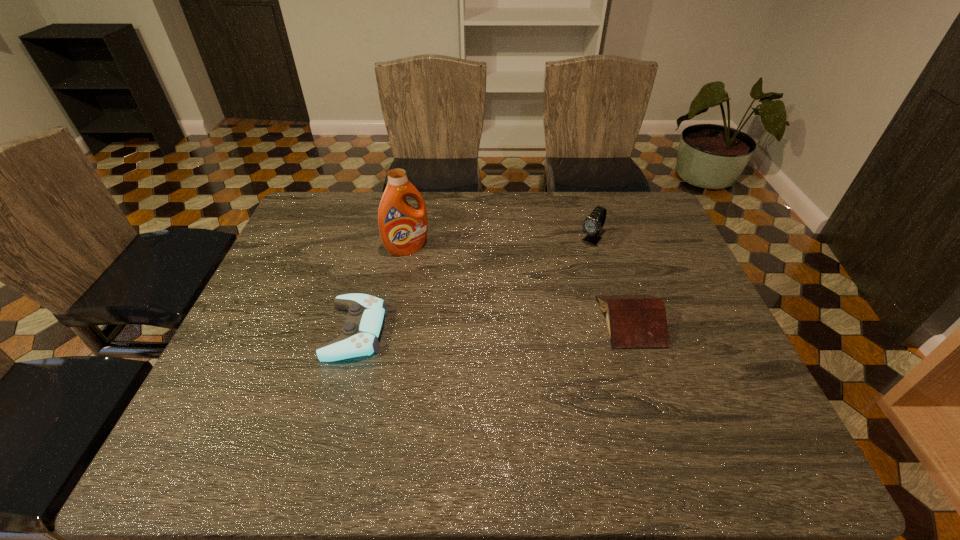
Find the location of `vacant region located 0.280m on the front-facing side of the tallest object`. vacant region located 0.280m on the front-facing side of the tallest object is located at coordinates 463,318.

Locate an element on the screen. The height and width of the screenshot is (540, 960). vacant space located on the front-facing side of the tallest object is located at coordinates (463, 318).

Find the location of a particular element. Image resolution: width=960 pixels, height=540 pixels. object present at the far edge is located at coordinates (592, 225).

At what (x,y) coordinates should I click in order to perform the action: click on object at the right edge. Please return your answer as a coordinate pair (x, y). Looking at the image, I should click on (633, 321).

Image resolution: width=960 pixels, height=540 pixels. Find the location of `vacant region at the far edge of the desktop`. vacant region at the far edge of the desktop is located at coordinates (344, 226).

Find the location of a particular element. This screenshot has height=540, width=960. vacant space at the near edge of the desktop is located at coordinates (642, 403).

This screenshot has height=540, width=960. Find the location of `vacant area at the left edge`. vacant area at the left edge is located at coordinates (255, 297).

This screenshot has height=540, width=960. In the image, there is a desktop. What are the coordinates of `free region at the right edge` in the screenshot? It's located at (655, 254).

This screenshot has width=960, height=540. Identify the location of vacant space at the near left corner of the desktop. (220, 414).

Where is `free space at the far right corner of the desktop`? free space at the far right corner of the desktop is located at coordinates (613, 198).